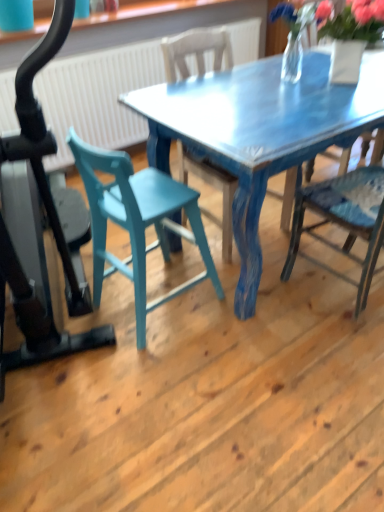
Describe the element at coordinates (137, 222) in the screenshot. I see `teal wood chair at center, which appears as the first chair when viewed from the left` at that location.

At what (x,y) coordinates should I click in order to perform the action: click on blue painted wood chair at right, the third chair positioned from the left. Please return your answer as a coordinate pair (x, y). Looking at the image, I should click on (344, 222).

Find the location of a particular element. Image resolution: width=384 pixels, height=512 pixels. teal wood chair at center, the third chair positioned from the right is located at coordinates tap(137, 222).

Is blue painted wood chair at center, the 2th chair positioned from the right, to the left of blue painted wood chair at right, which is the first chair from right to left, from the viewer's perspective?

Correct, you'll find blue painted wood chair at center, the 2th chair positioned from the right, to the left of blue painted wood chair at right, which is the first chair from right to left.

Is blue painted wood chair at center, the 2th chair positioned from the right, located outside blue painted wood chair at right, the third chair positioned from the left?

Absolutely, blue painted wood chair at center, the 2th chair positioned from the right, is external to blue painted wood chair at right, the third chair positioned from the left.

Is blue painted wood chair at center, which is the 2th chair in left-to-right order, wider or thinner than blue painted wood chair at right, the third chair positioned from the left?

Clearly, blue painted wood chair at center, which is the 2th chair in left-to-right order, has more width compared to blue painted wood chair at right, the third chair positioned from the left.

Where is `chair above the blue painted wood chair at right, which is the first chair from right to left (from the image's perspective)`? This screenshot has height=512, width=384. chair above the blue painted wood chair at right, which is the first chair from right to left (from the image's perspective) is located at coordinates (195, 51).

Between point (318, 195) and point (225, 240), which one is positioned in front?

The point (318, 195) is more forward.

Is blue painted wood chair at right, the third chair positioned from the left, turned away from blue painted wood chair at center, which is the 2th chair in left-to-right order?

blue painted wood chair at right, the third chair positioned from the left, is not turned away from blue painted wood chair at center, which is the 2th chair in left-to-right order.

Who is bigger, blue painted wood chair at right, the third chair positioned from the left, or blue painted wood chair at center, the 2th chair positioned from the right?

blue painted wood chair at center, the 2th chair positioned from the right, is bigger.

Considering the positions of objects teal wood chair at center, which appears as the first chair when viewed from the left, and blue painted wood chair at right, the third chair positioned from the left, in the image provided, who is in front, teal wood chair at center, which appears as the first chair when viewed from the left, or blue painted wood chair at right, the third chair positioned from the left,?

Positioned in front is blue painted wood chair at right, the third chair positioned from the left.

Consider the image. Is blue painted wood chair at right, the third chair positioned from the left, at the back of teal wood chair at center, which appears as the first chair when viewed from the left?

No.

Considering the sizes of objects teal wood chair at center, which appears as the first chair when viewed from the left, and blue painted wood chair at right, the third chair positioned from the left, in the image provided, who is thinner, teal wood chair at center, which appears as the first chair when viewed from the left, or blue painted wood chair at right, the third chair positioned from the left,?

teal wood chair at center, which appears as the first chair when viewed from the left.

Is blue painted wood chair at center, the 2th chair positioned from the right, turned away from teal wood chair at center, which appears as the first chair when viewed from the left?

No, teal wood chair at center, which appears as the first chair when viewed from the left, is not at the back of blue painted wood chair at center, the 2th chair positioned from the right.

Does blue painted wood chair at center, the 2th chair positioned from the right, come behind teal wood chair at center, the third chair positioned from the right?

Yes, blue painted wood chair at center, the 2th chair positioned from the right, is further from the viewer.

From the image's perspective, does blue painted wood chair at center, which is the 2th chair in left-to-right order, appear lower than teal wood chair at center, which appears as the first chair when viewed from the left?

Answer: Incorrect, from the image's perspective, blue painted wood chair at center, which is the 2th chair in left-to-right order, is higher than teal wood chair at center, which appears as the first chair when viewed from the left.

The width and height of the screenshot is (384, 512). I want to click on chair that is the 1st one when counting rightward from the teal wood chair at center, which appears as the first chair when viewed from the left, so click(195, 51).

From a real-world perspective, is teal wood chair at center, which appears as the first chair when viewed from the left, located beneath blue painted wood chair at center, the 2th chair positioned from the right?

Yes, from a real-world perspective, teal wood chair at center, which appears as the first chair when viewed from the left, is below blue painted wood chair at center, the 2th chair positioned from the right.

In the scene shown: Considering the positions of objects teal wood chair at center, the third chair positioned from the right, and blue painted wood chair at center, the 2th chair positioned from the right, in the image provided, who is more to the right, teal wood chair at center, the third chair positioned from the right, or blue painted wood chair at center, the 2th chair positioned from the right,?

blue painted wood chair at center, the 2th chair positioned from the right, is more to the right.

Which of these two, teal wood chair at center, which appears as the first chair when viewed from the left, or blue painted wood chair at center, which is the 2th chair in left-to-right order, is bigger?

With larger size is blue painted wood chair at center, which is the 2th chair in left-to-right order.

From the image's perspective, between teal wood chair at center, the third chair positioned from the right, and blue painted wood chair at center, which is the 2th chair in left-to-right order, who is located below?

From the image's view, teal wood chair at center, the third chair positioned from the right, is below.

Where is `the 1st chair above when counting from the teal wood chair at center, the third chair positioned from the right (from the image's perspective)`? the 1st chair above when counting from the teal wood chair at center, the third chair positioned from the right (from the image's perspective) is located at coordinates (344, 222).

Is blue painted wood chair at right, the third chair positioned from the left, positioned beyond the bounds of teal wood chair at center, which appears as the first chair when viewed from the left?

blue painted wood chair at right, the third chair positioned from the left, is positioned outside teal wood chair at center, which appears as the first chair when viewed from the left.

Can you confirm if blue painted wood chair at right, the third chair positioned from the left, is wider than teal wood chair at center, the third chair positioned from the right?

Indeed, blue painted wood chair at right, the third chair positioned from the left, has a greater width compared to teal wood chair at center, the third chair positioned from the right.

Image resolution: width=384 pixels, height=512 pixels. Identify the location of the 2nd chair in front of the blue painted wood chair at center, the 2th chair positioned from the right, starting your count from the anchor. (344, 222).

At what (x,y) coordinates should I click in order to perform the action: click on chair above the blue painted wood chair at center, the 2th chair positioned from the right (from a real-world perspective). Please return your answer as a coordinate pair (x, y). This screenshot has width=384, height=512. Looking at the image, I should click on (344, 222).

From the image, which object appears to be farther from blue painted wood chair at right, the third chair positioned from the left, blue painted wood chair at center, the 2th chair positioned from the right, or teal wood chair at center, the third chair positioned from the right?

blue painted wood chair at center, the 2th chair positioned from the right, lies further to blue painted wood chair at right, the third chair positioned from the left, than the other object.

Estimate the real-world distances between objects in this image. Which object is closer to blue painted wood chair at center, which is the 2th chair in left-to-right order, blue painted wood chair at right, the third chair positioned from the left, or teal wood chair at center, which appears as the first chair when viewed from the left?

teal wood chair at center, which appears as the first chair when viewed from the left.

From the image, which object appears to be nearer to blue painted wood chair at center, the 2th chair positioned from the right, teal wood chair at center, which appears as the first chair when viewed from the left, or blue painted wood chair at right, which is the first chair from right to left?

teal wood chair at center, which appears as the first chair when viewed from the left.

Consider the image. From the image, which object appears to be nearer to teal wood chair at center, the third chair positioned from the right, blue painted wood chair at center, the 2th chair positioned from the right, or blue painted wood chair at right, which is the first chair from right to left?

The object closer to teal wood chair at center, the third chair positioned from the right, is blue painted wood chair at right, which is the first chair from right to left.

Estimate the real-world distances between objects in this image. Which object is further from teal wood chair at center, which appears as the first chair when viewed from the left, blue painted wood chair at right, the third chair positioned from the left, or blue painted wood chair at center, which is the 2th chair in left-to-right order?

Among the two, blue painted wood chair at center, which is the 2th chair in left-to-right order, is located further to teal wood chair at center, which appears as the first chair when viewed from the left.

From the image, which object appears to be nearer to blue painted wood chair at right, which is the first chair from right to left, teal wood chair at center, which appears as the first chair when viewed from the left, or blue painted wood chair at center, the 2th chair positioned from the right?

Among the two, teal wood chair at center, which appears as the first chair when viewed from the left, is located nearer to blue painted wood chair at right, which is the first chair from right to left.

Identify the location of chair located between teal wood chair at center, the third chair positioned from the right, and blue painted wood chair at right, which is the first chair from right to left, in the left-right direction. This screenshot has width=384, height=512. (195, 51).